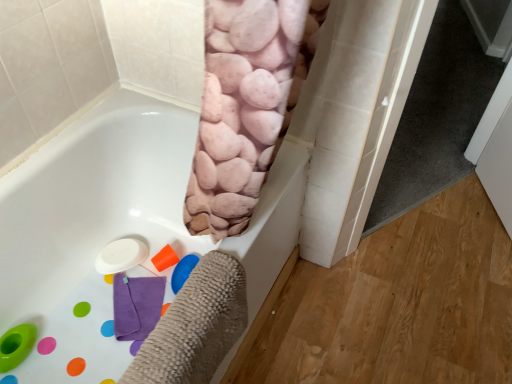
Question: From a real-world perspective, is white matte bathtub at center above or below white glossy screen door at right?

Choices:
 (A) below
 (B) above

Answer: (A)

Question: From the image's perspective, relative to white glossy screen door at right, is white matte bathtub at center above or below?

Choices:
 (A) above
 (B) below

Answer: (B)

Question: In terms of height, does white matte bathtub at center look taller or shorter compared to white glossy screen door at right?

Choices:
 (A) short
 (B) tall

Answer: (A)

Question: In the image, is white glossy screen door at right positioned in front of or behind white matte bathtub at center?

Choices:
 (A) behind
 (B) front

Answer: (A)

Question: Is white glossy screen door at right spatially inside white matte bathtub at center, or outside of it?

Choices:
 (A) inside
 (B) outside

Answer: (B)

Question: In terms of width, does white glossy screen door at right look wider or thinner when compared to white matte bathtub at center?

Choices:
 (A) wide
 (B) thin

Answer: (B)

Question: From a real-world perspective, relative to white matte bathtub at center, is white glossy screen door at right vertically above or below?

Choices:
 (A) below
 (B) above

Answer: (B)